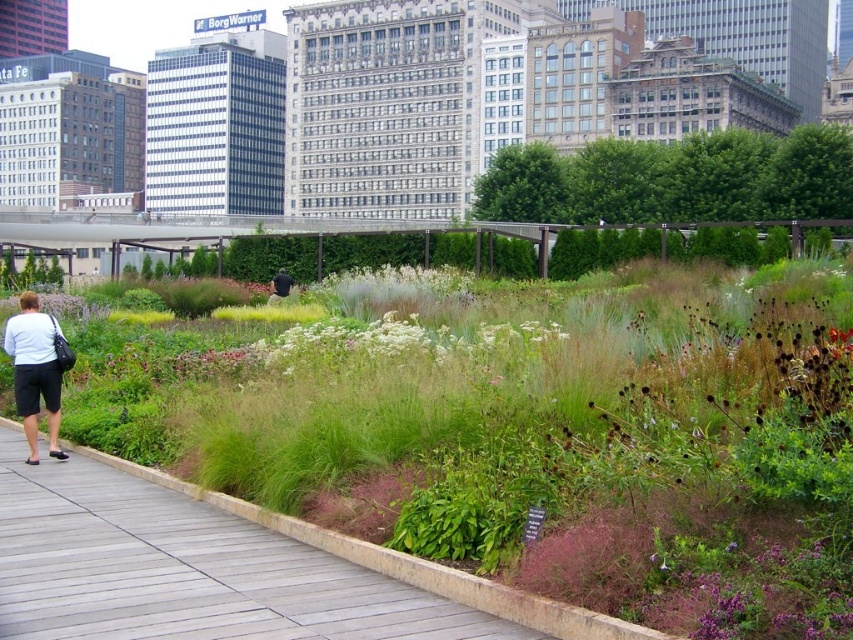
Is green grass at center shorter than black fabric at center?

No, green grass at center is not shorter than black fabric at center.

Looking at this image, does green grass at center have a greater height compared to black fabric at center?

Yes, green grass at center is taller than black fabric at center.

Identify the location of green grass at center. (544, 442).

Does wooden at left have a larger size compared to white matte shorts at left?

Yes, wooden at left is bigger than white matte shorts at left.

Does point (70, 582) come closer to viewer compared to point (6, 337)?

Yes.

The image size is (853, 640). I want to click on wooden at left, so click(x=184, y=570).

Is green grass at center smaller than white fluffy plant at center?

No.

Is point (846, 300) farther from viewer compared to point (427, 349)?

That is True.

Describe the element at coordinates (544, 442) in the screenshot. Image resolution: width=853 pixels, height=640 pixels. I see `green grass at center` at that location.

Where is `green grass at center`? This screenshot has width=853, height=640. green grass at center is located at coordinates (544, 442).